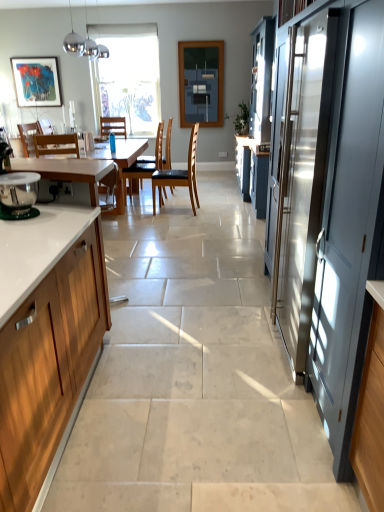
Question: In terms of height, does white wood cabinet at left look taller or shorter compared to matte glass window screen at center?

Choices:
 (A) short
 (B) tall

Answer: (A)

Question: Looking at the image, does white wood cabinet at left seem bigger or smaller compared to matte glass window screen at center?

Choices:
 (A) big
 (B) small

Answer: (A)

Question: Considering the real-world distances, which object is closest to the matte gray screen door at right?

Choices:
 (A) matte black picture frame at upper left
 (B) wooden chair at center, which is counted as the third chair, starting from the right
 (C) black leather chair at center, placed as the first chair when sorted from right to left
 (D) matte glass window screen at center
 (E) wooden chair at center, which is counted as the fourth chair, starting from the right

Answer: (B)

Question: Which object is positioned closest to the wooden chair at center, the 3th chair when ordered from left to right?

Choices:
 (A) black leather chair at center, placed as the first chair when sorted from right to left
 (B) matte black picture frame at upper left
 (C) transparent glass window at center
 (D) matte glass window screen at center
 (E) wooden chair at center, which is counted as the third chair, starting from the right

Answer: (A)